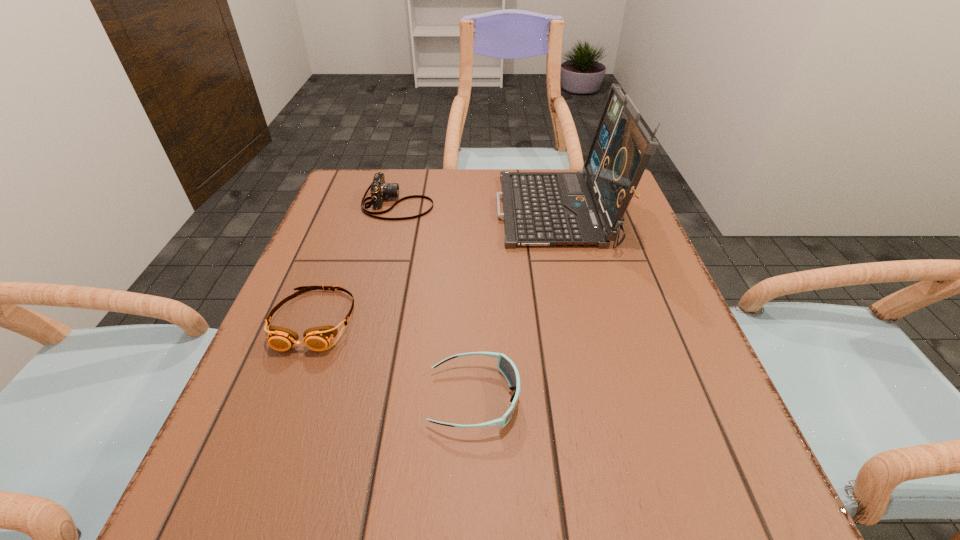
Image resolution: width=960 pixels, height=540 pixels. I want to click on vacant space located 0.080m with the lenses facing forward on the left goggles, so click(x=287, y=393).

What are the coordinates of `vacant space positioned on the front-facing side of the right goggles` in the screenshot? It's located at [x=654, y=398].

Identify the location of laptop computer positioned at the far edge. Image resolution: width=960 pixels, height=540 pixels. (539, 208).

Find the location of a particular element. This screenshot has height=540, width=960. camera at the far edge is located at coordinates (379, 189).

What are the coordinates of `camera that is at the left edge` in the screenshot? It's located at pyautogui.click(x=379, y=189).

Identify the location of goggles that is at the left edge. (318, 338).

Find the location of a particular element. This screenshot has height=540, width=960. object present at the right edge is located at coordinates (539, 208).

You are a GUI agent. You are given a task and a screenshot of the screen. Output one action in this format:
    pyautogui.click(x=<x>, y=<y>)
    Task: Click on the object at the far left corner
    
    Given the screenshot: What is the action you would take?
    pos(379,189)

Find the location of `object positioned at the far right corner`. object positioned at the far right corner is located at coordinates (539, 208).

Locate an element on the screen. vacant space at the far edge of the desktop is located at coordinates (487, 186).